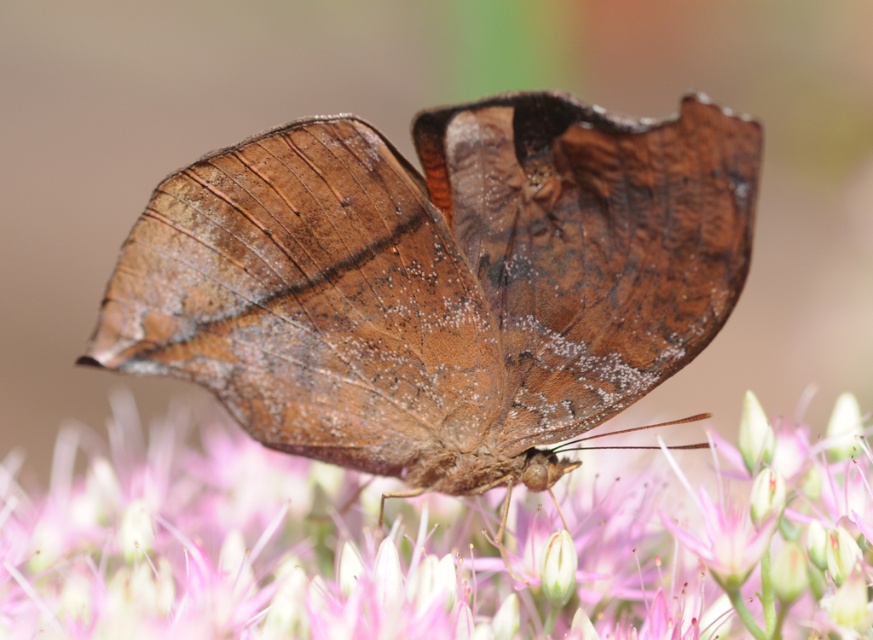
Does brown matte butterfly at center appear on the right side of pink fuzzy flower at center?

Yes, brown matte butterfly at center is to the right of pink fuzzy flower at center.

Identify the location of brown matte butterfly at center. (441, 282).